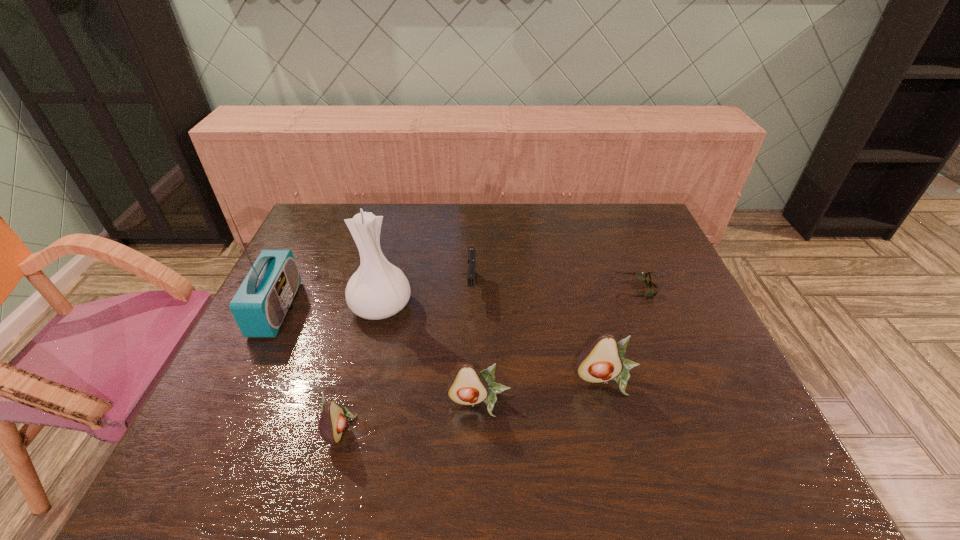
The image size is (960, 540). In order to click on the fifth tallest object in this screenshot , I will do pos(333,420).

At what (x,y) coordinates should I click in order to perform the action: click on the leftmost avocado. Please return your answer as a coordinate pair (x, y). Image resolution: width=960 pixels, height=540 pixels. Looking at the image, I should click on (x=333, y=420).

At what (x,y) coordinates should I click in order to perform the action: click on the second avocado from left to right. Please return your answer as a coordinate pair (x, y). Looking at the image, I should click on (468, 386).

At what (x,y) coordinates should I click in order to perform the action: click on the second tallest avocado. Please return your answer as a coordinate pair (x, y). The height and width of the screenshot is (540, 960). Looking at the image, I should click on (468, 386).

Locate an element on the screen. The height and width of the screenshot is (540, 960). the rightmost avocado is located at coordinates (601, 361).

You are a GUI agent. You are given a task and a screenshot of the screen. Output one action in this format:
    pyautogui.click(x=<x>, y=<y>)
    Task: Click on the sixth shortest object
    
    Given the screenshot: What is the action you would take?
    pyautogui.click(x=377, y=290)

I want to click on the leftmost object, so click(x=261, y=303).

Find the location of a particular element. The width and height of the screenshot is (960, 540). the sixth tallest object is located at coordinates (471, 250).

Image resolution: width=960 pixels, height=540 pixels. Find the location of `spectacles`. spectacles is located at coordinates (645, 277).

You are a GUI agent. You are given a task and a screenshot of the screen. Output one action in this format:
    pyautogui.click(x=<x>, y=<y>)
    Task: Click on the shortest object
    This screenshot has width=960, height=540.
    Given the screenshot: What is the action you would take?
    pyautogui.click(x=645, y=277)